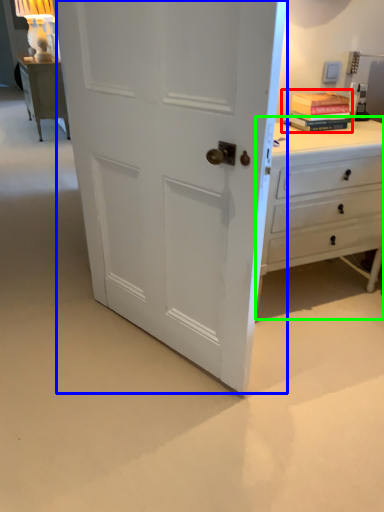
Question: Considering the real-world distances, which object is farthest from book (highlighted by a red box)? door (highlighted by a blue box) or chest of drawers (highlighted by a green box)?

Choices:
 (A) door
 (B) chest of drawers

Answer: (A)